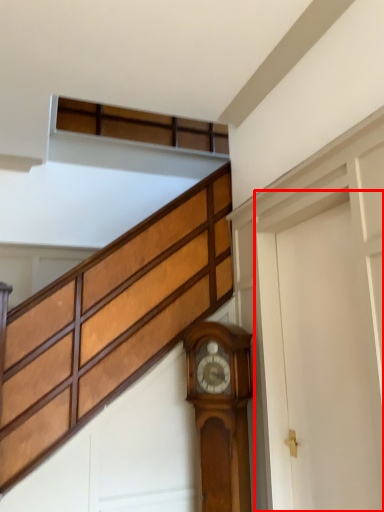
Question: Observing the image, what is the correct spatial positioning of garage door (annotated by the red box) in reference to wall clock?

Choices:
 (A) right
 (B) left

Answer: (A)